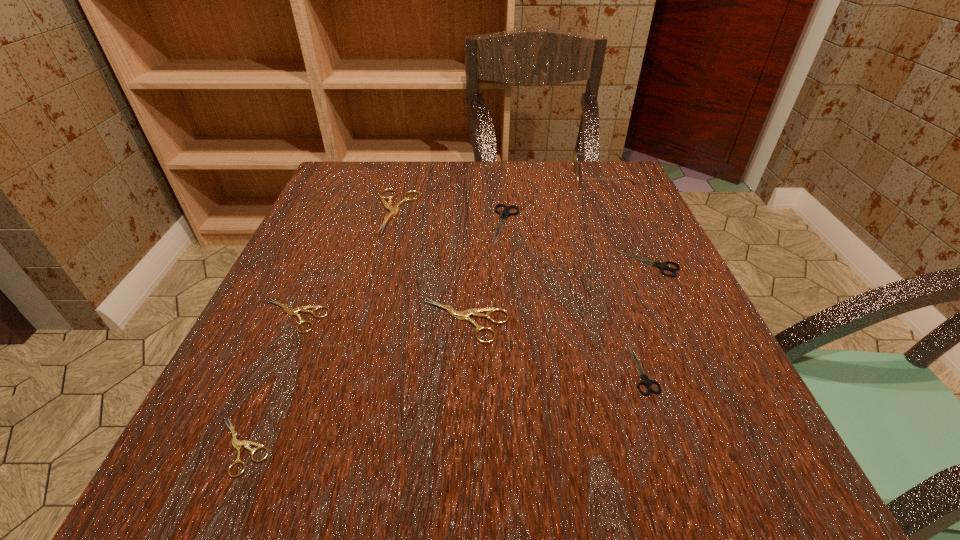
Where is `the farthest object`? Image resolution: width=960 pixels, height=540 pixels. the farthest object is located at coordinates (575, 160).

Find the location of a particular element. This screenshot has height=540, width=960. green sunglasses is located at coordinates (575, 160).

Find the location of a particular element. The image size is (960, 540). the biggest black shears is located at coordinates (504, 214).

The height and width of the screenshot is (540, 960). I want to click on the leftmost black shears, so click(504, 214).

Where is `the third object from left to right`? the third object from left to right is located at coordinates (393, 210).

I want to click on the third shears from left to right, so click(x=393, y=210).

Image resolution: width=960 pixels, height=540 pixels. I want to click on the fourth farthest object, so click(662, 266).

The height and width of the screenshot is (540, 960). What are the coordinates of `the third farthest shears` in the screenshot? It's located at (662, 266).

The height and width of the screenshot is (540, 960). Find the location of `the second biggest beige shears`. the second biggest beige shears is located at coordinates (475, 312).

At what (x,y) coordinates should I click in order to perform the action: click on the third biggest beige shears. Please return your answer as a coordinate pair (x, y). The width and height of the screenshot is (960, 540). Looking at the image, I should click on (304, 309).